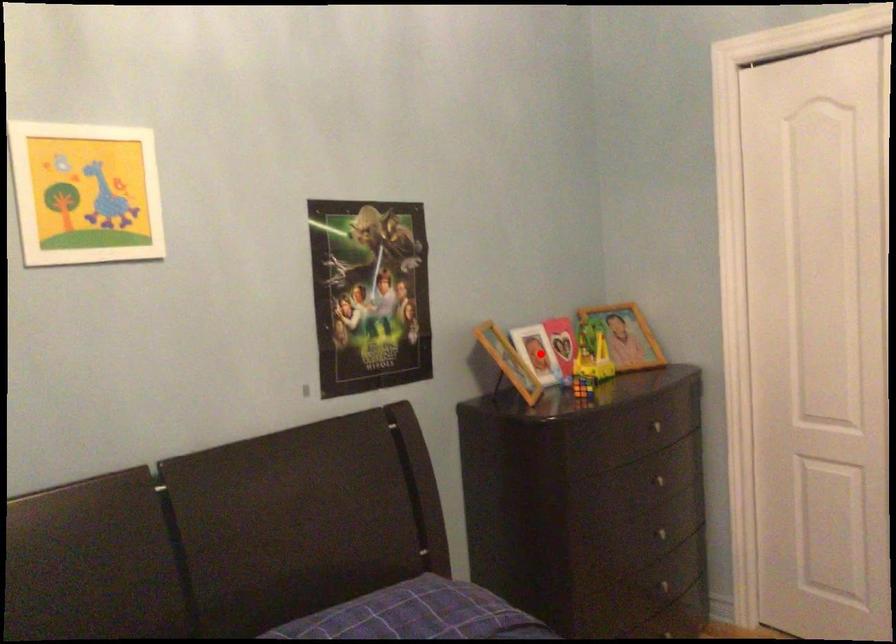
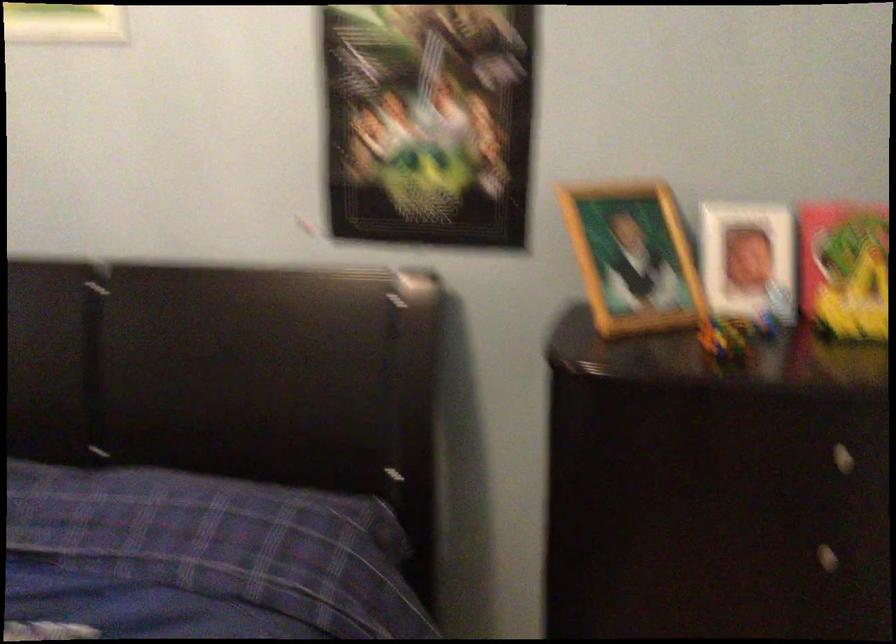
Question: I am providing you with two images of the same scene from different viewpoints. Given a red point in image1, look at the same physical point in image2. Is it:

Choices:
 (A) Closer to the viewpoint
 (B) Farther from the viewpoint

Answer: (A)